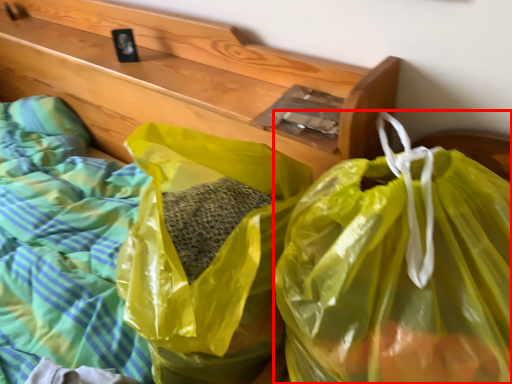
Question: In this image, where is plastic bag (annotated by the red box) located relative to plastic bag?

Choices:
 (A) left
 (B) right

Answer: (B)